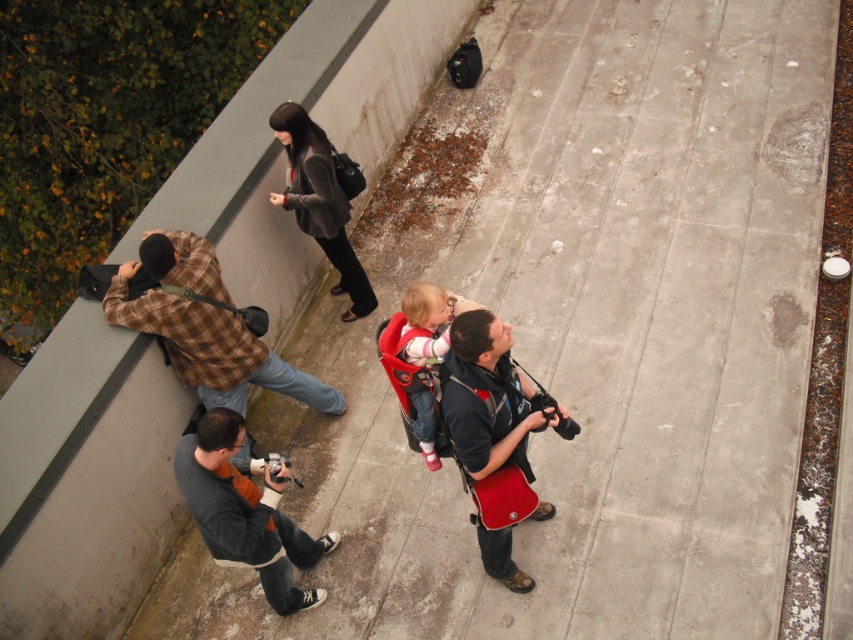
Question: Based on their relative distances, which object is farther from the brown plaid shirt at left?

Choices:
 (A) velvet brown jacket at upper center
 (B) matte black backpack at center
 (C) matte pink baby carrier at center
 (D) dark gray sweater at lower left

Answer: (B)

Question: Where is concrete ledge at upper left located in relation to matte pink baby carrier at center in the image?

Choices:
 (A) right
 (B) left

Answer: (B)

Question: Among these objects, which one is farthest from the camera?

Choices:
 (A) dark gray sweater at lower left
 (B) velvet brown jacket at upper center

Answer: (B)

Question: Does brown plaid shirt at left come in front of matte black backpack at center?

Choices:
 (A) no
 (B) yes

Answer: (A)

Question: Can you confirm if brown plaid shirt at left is smaller than matte black backpack at center?

Choices:
 (A) no
 (B) yes

Answer: (A)

Question: Which point is closer to the camera taking this photo?

Choices:
 (A) (485, 529)
 (B) (364, 298)
 (C) (126, 403)
 (D) (428, 291)

Answer: (D)